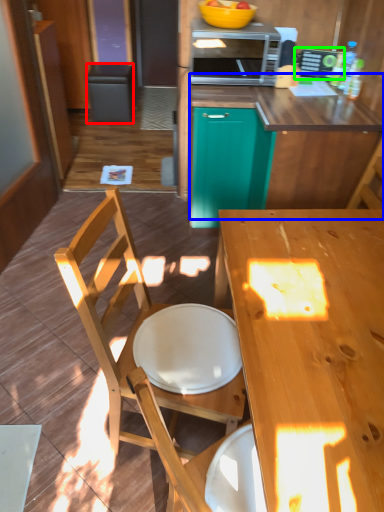
Question: Estimate the real-world distances between objects in this image. Which object is farther from trash bin/can (highlighted by a red box), counter (highlighted by a blue box) or appliance (highlighted by a green box)?

Choices:
 (A) counter
 (B) appliance

Answer: (A)